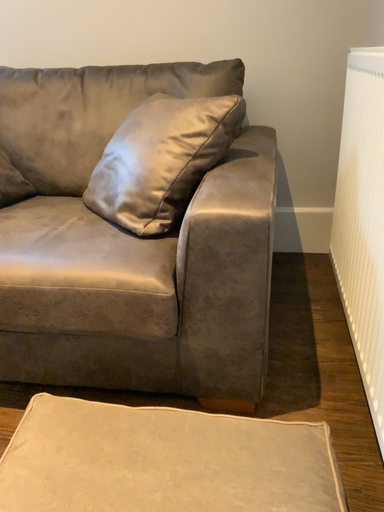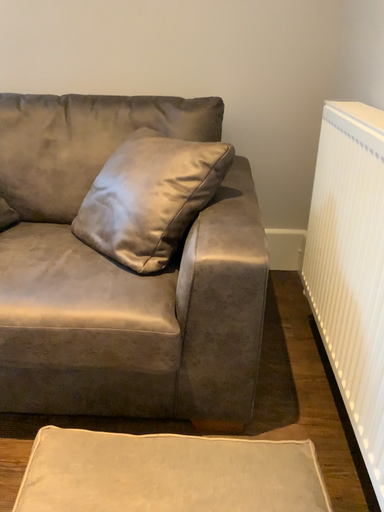
Question: Which way did the camera rotate in the video?

Choices:
 (A) rotated right
 (B) rotated left

Answer: (A)